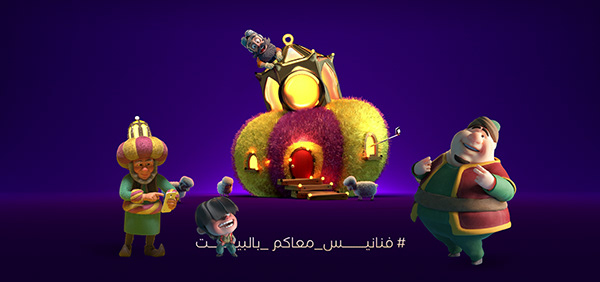
Image resolution: width=600 pixels, height=282 pixels. I want to click on window, so click(x=254, y=159), click(x=371, y=152).